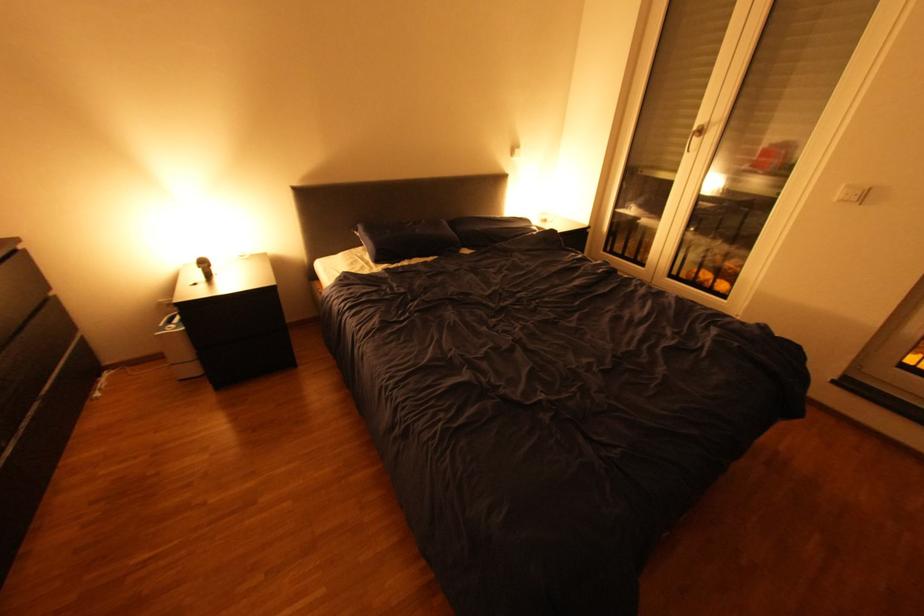
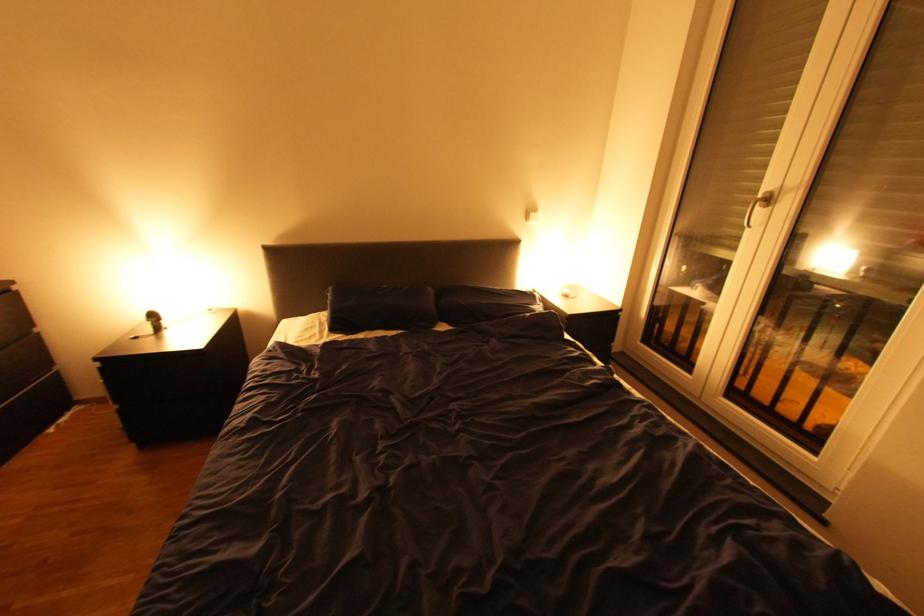
Where in the second image is the point corresponding to (x=394, y=264) from the first image?

(348, 333)